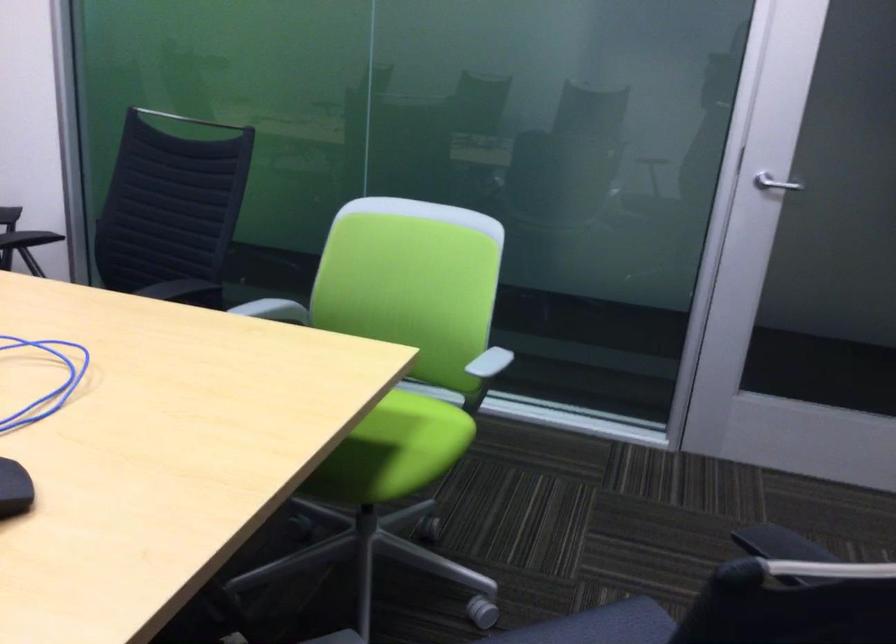
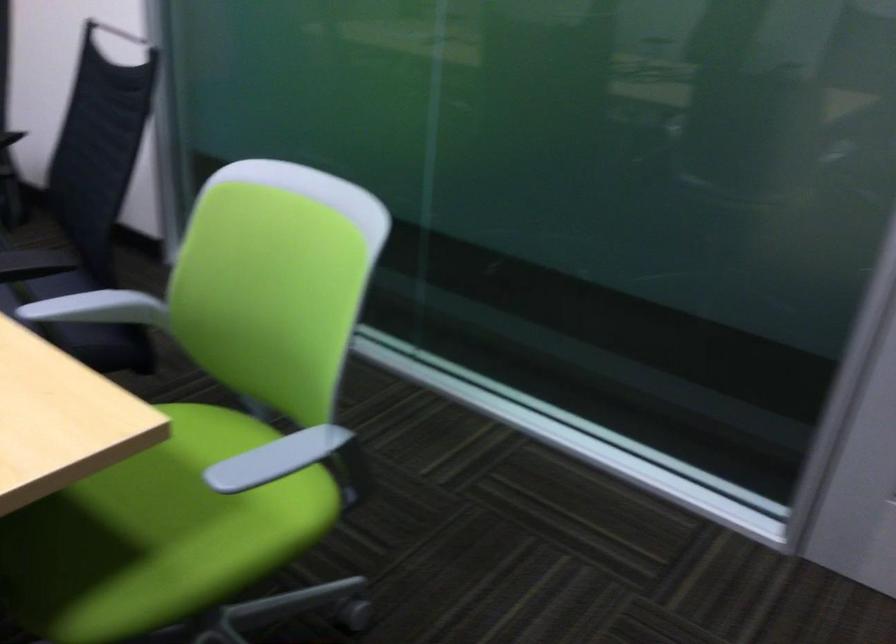
Find the pixel in the second image that matches point (386, 440) in the first image.

(157, 534)